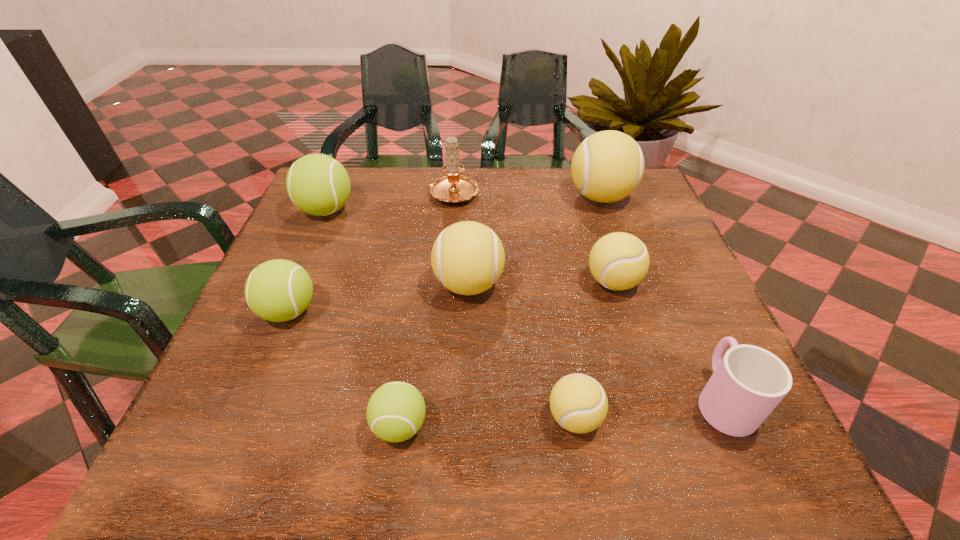
At what (x,y) coordinates should I click in order to perform the action: click on vacant space at the near edge of the desktop. Please return your answer as a coordinate pair (x, y). Looking at the image, I should click on (355, 451).

Identify the location of vacant space at the left edge of the desktop. This screenshot has height=540, width=960. (222, 403).

Where is `vacant space at the right edge of the desktop`? vacant space at the right edge of the desktop is located at coordinates [x=670, y=334].

You are a GUI agent. You are given a task and a screenshot of the screen. Output one action in this format:
    pyautogui.click(x=<x>, y=<y>)
    Task: Click on the free location at the far left corner of the desktop
    
    Given the screenshot: What is the action you would take?
    pyautogui.click(x=351, y=212)

The width and height of the screenshot is (960, 540). I want to click on free space at the near left corner of the desktop, so click(238, 436).

Where is `free spot between the farthest yellow tennis ball and the candle`? This screenshot has height=540, width=960. free spot between the farthest yellow tennis ball and the candle is located at coordinates (528, 194).

The width and height of the screenshot is (960, 540). In order to click on vacant space that is in between the leftmost yellow tennis ball and the cup in this screenshot , I will do `click(595, 342)`.

Where is `free point between the biggest green tennis ball and the second biggest green tennis ball`? The image size is (960, 540). free point between the biggest green tennis ball and the second biggest green tennis ball is located at coordinates (307, 261).

Identify the location of free space between the biggest green tennis ball and the leftmost yellow tennis ball. This screenshot has height=540, width=960. (397, 247).

Identify the location of free space between the cup and the smallest yellow tennis ball. This screenshot has width=960, height=540. (648, 408).